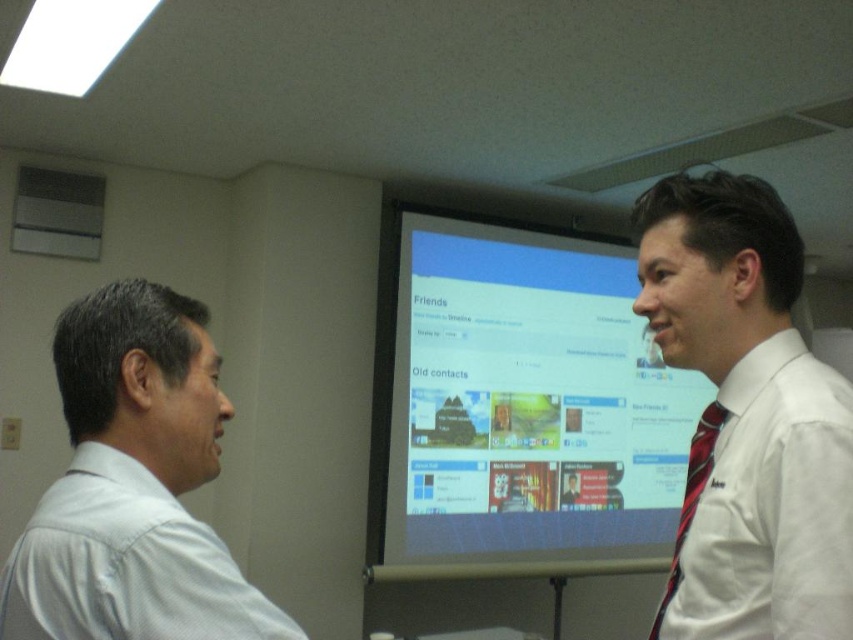
Does light blue shirt at left have a smaller size compared to red striped tie at right?

Yes, light blue shirt at left is smaller than red striped tie at right.

Is light blue shirt at left positioned in front of red striped tie at right?

That is True.

The image size is (853, 640). Describe the element at coordinates (132, 484) in the screenshot. I see `light blue shirt at left` at that location.

Where is `light blue shirt at left`? Image resolution: width=853 pixels, height=640 pixels. light blue shirt at left is located at coordinates (132, 484).

Can you confirm if matte plastic monitor at center is wider than white shirt at center?

Yes.

Does matte plastic monitor at center appear on the right side of white shirt at center?

Correct, you'll find matte plastic monitor at center to the right of white shirt at center.

Is point (502, 433) in front of point (811, 618)?

That is False.

Identify the location of matte plastic monitor at center. (520, 406).

Is matte plastic monitor at center shorter than red striped tie at right?

In fact, matte plastic monitor at center may be taller than red striped tie at right.

Who is more forward, (x=440, y=472) or (x=715, y=403)?

Positioned in front is point (x=715, y=403).

You are a GUI agent. You are given a task and a screenshot of the screen. Output one action in this format:
    pyautogui.click(x=<x>, y=<y>)
    Task: Click on the matte plastic monitor at center
    This screenshot has height=640, width=853.
    Given the screenshot: What is the action you would take?
    pyautogui.click(x=520, y=406)